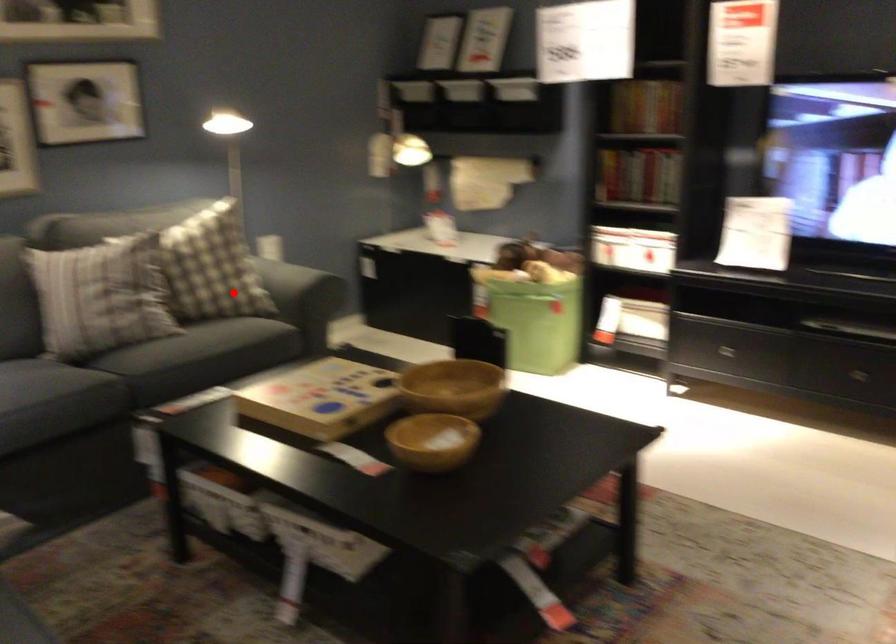
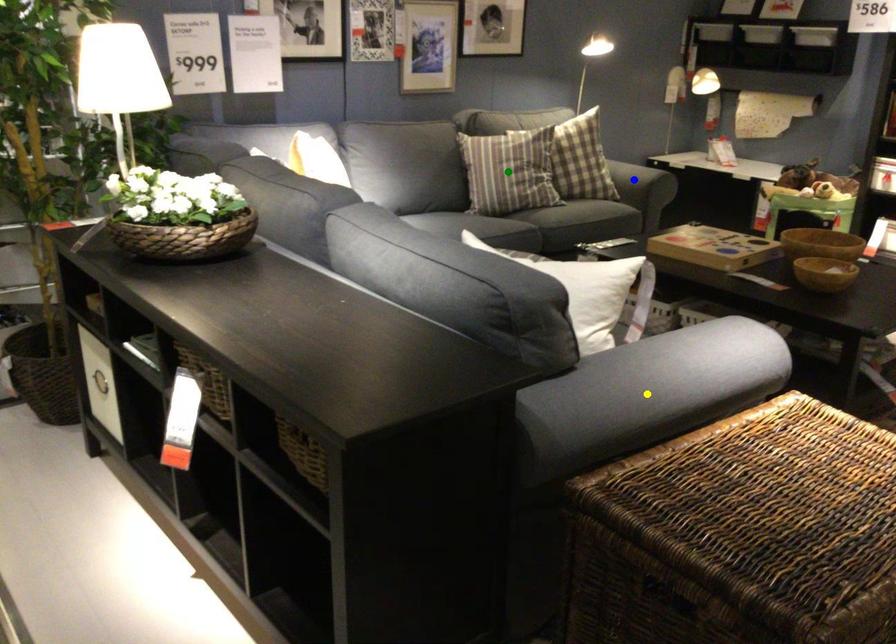
Question: I am providing you with two images of the same scene from different viewpoints. A red point is marked on the first image. You are given multiple points on the second image. Which mark in image 2 goes with the point in image 1?

Choices:
 (A) green point
 (B) blue point
 (C) yellow point

Answer: (B)